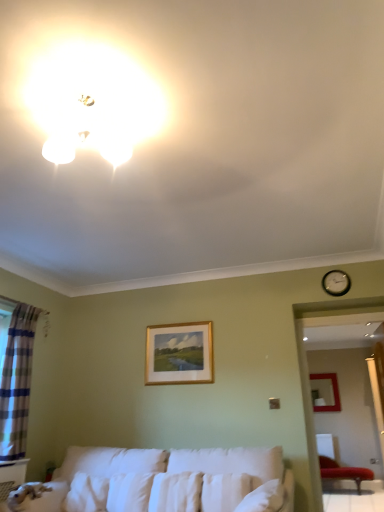
Question: Is white soft pillow at center, acting as the 2th pillow starting from the right, thinner than gold wooden picture frame at center, positioned as the 1th picture frame in left-to-right order?

Choices:
 (A) yes
 (B) no

Answer: (B)

Question: Is white soft pillow at center, acting as the 2th pillow starting from the right, smaller than gold wooden picture frame at center, the second picture frame from the back?

Choices:
 (A) yes
 (B) no

Answer: (B)

Question: From a real-world perspective, is white soft pillow at center, positioned as the 1th pillow in left-to-right order, located beneath gold wooden picture frame at center, which is the 2th picture frame in right-to-left order?

Choices:
 (A) yes
 (B) no

Answer: (A)

Question: Is white soft pillow at center, positioned as the 1th pillow in left-to-right order, further to camera compared to gold wooden picture frame at center, positioned as the 1th picture frame in left-to-right order?

Choices:
 (A) yes
 (B) no

Answer: (B)

Question: Does white soft pillow at center, acting as the 2th pillow starting from the right, have a greater height compared to gold wooden picture frame at center, the 1th picture frame positioned from the front?

Choices:
 (A) yes
 (B) no

Answer: (B)

Question: Can you confirm if white soft pillow at center, acting as the 2th pillow starting from the right, is positioned to the right of gold wooden picture frame at center, positioned as the 1th picture frame in left-to-right order?

Choices:
 (A) no
 (B) yes

Answer: (A)

Question: Is matte white light fixture at upper left facing away from velvet red chair at lower right?

Choices:
 (A) no
 (B) yes

Answer: (A)

Question: Does matte white light fixture at upper left have a greater width compared to velvet red chair at lower right?

Choices:
 (A) no
 (B) yes

Answer: (A)

Question: From a real-world perspective, is matte white light fixture at upper left over velvet red chair at lower right?

Choices:
 (A) no
 (B) yes

Answer: (B)

Question: Does matte white light fixture at upper left have a lesser width compared to velvet red chair at lower right?

Choices:
 (A) no
 (B) yes

Answer: (B)

Question: Is matte white light fixture at upper left outside of velvet red chair at lower right?

Choices:
 (A) no
 (B) yes

Answer: (B)

Question: Is matte white light fixture at upper left positioned before velvet red chair at lower right?

Choices:
 (A) no
 (B) yes

Answer: (B)

Question: Is velvet red chair at lower right wider than plaid fabric curtain at left?

Choices:
 (A) yes
 (B) no

Answer: (A)